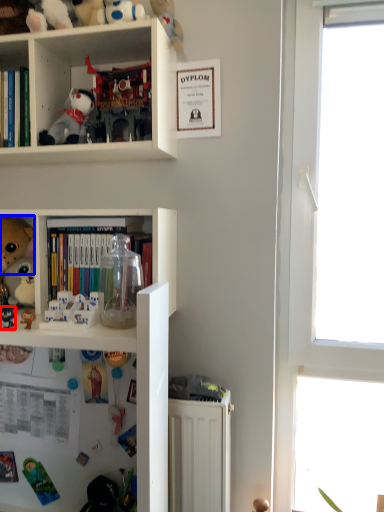
Question: Which point is closer to the camera, toy (highlighted by a red box) or toy (highlighted by a blue box)?

Choices:
 (A) toy
 (B) toy

Answer: (A)